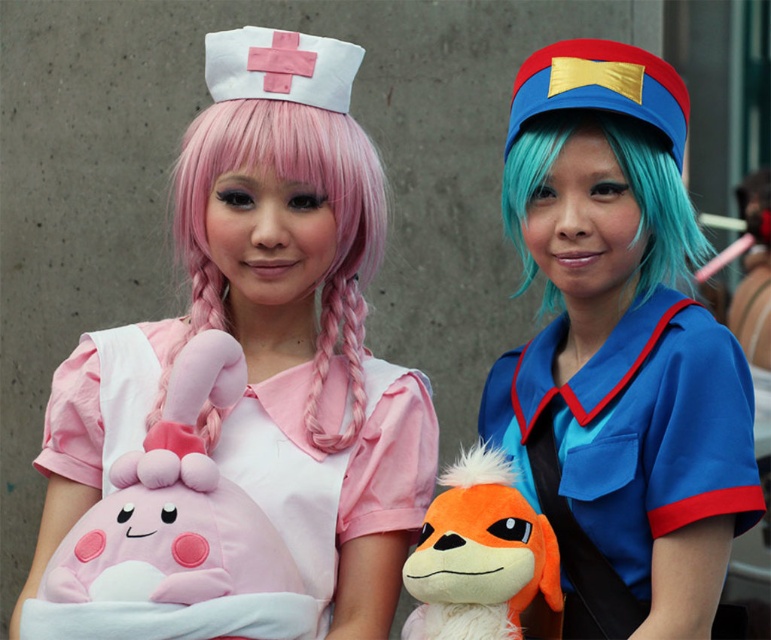
You are a photographer setting up for a photo shoot with two cosplayers. You notice the matte pink plushie at center and the pink silky hair at center. Which object should you adjust the camera focus on first if you want to capture both clearly?

The matte pink plushie at center is much taller than the pink silky hair at center, so you should focus on the taller object first to ensure depth of field covers both.

You are a photographer trying to capture a closeup of the matte pink plushie at center. Based on its coordinates, where should you aim your camera?

The matte pink plushie at center is located at coordinates point (x=301, y=317), so aim your camera slightly to the right and down from the center of the image to capture it.